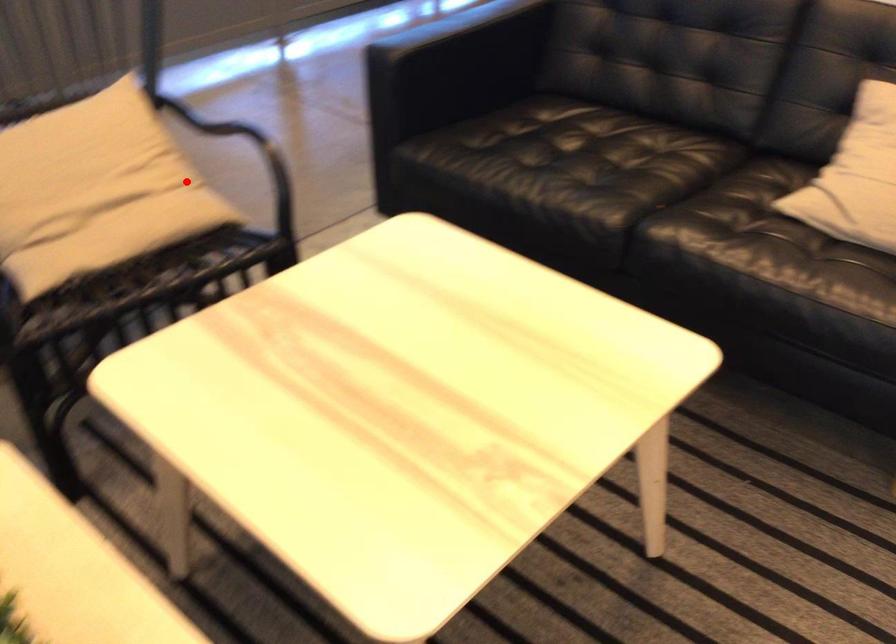
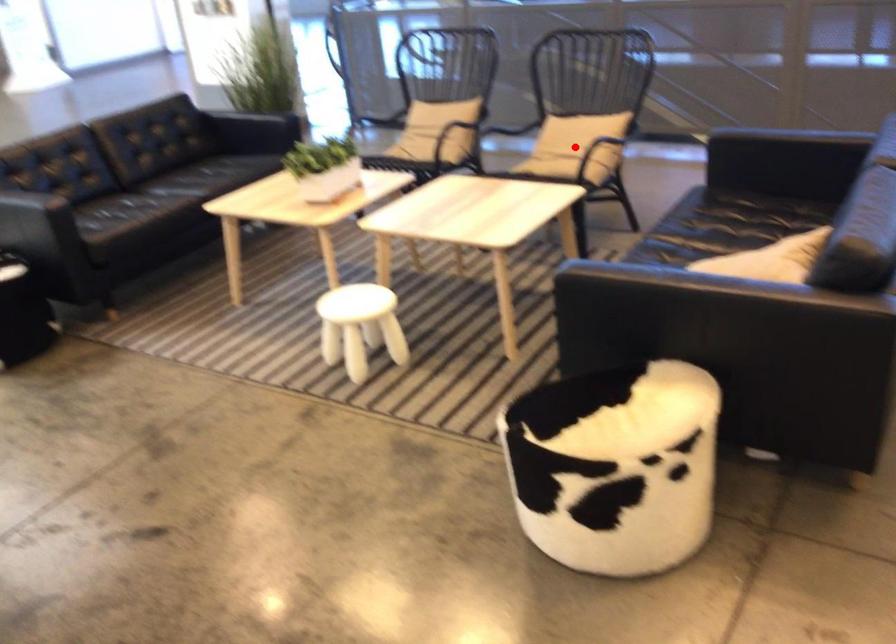
I am providing you with two images of the same scene from different viewpoints. A red point is marked on the first image and another point is marked on the second image. Are the points marked in image1 and image2 representing the same 3D position?

Yes